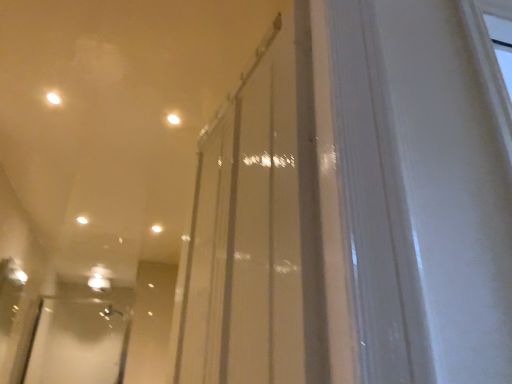
What do you see at coordinates (156, 229) in the screenshot? I see `white glossy light at center, the third light from the front` at bounding box center [156, 229].

What is the approximate width of transparent glass door at center?

transparent glass door at center is 4.95 inches wide.

Image resolution: width=512 pixels, height=384 pixels. I want to click on matte white light at upper center, the 3th light in the back-to-front sequence, so click(173, 119).

How much space does white glossy light at upper center, positioned as the 1th light in left-to-right order, occupy vertically?

The height of white glossy light at upper center, positioned as the 1th light in left-to-right order, is 0.58 inches.

Where is `white glossy light at center, the 1th light in the bottom-to-top sequence`? Image resolution: width=512 pixels, height=384 pixels. white glossy light at center, the 1th light in the bottom-to-top sequence is located at coordinates (156, 229).

Looking at this image, which of these two, matte white light at upper center, which is counted as the 1th light, starting from the right, or transparent glass door at center, stands shorter?

matte white light at upper center, which is counted as the 1th light, starting from the right.

From the picture: Considering the positions of objects matte white light at upper center, the 3th light in the back-to-front sequence, and transparent glass door at center in the image provided, who is more to the right, matte white light at upper center, the 3th light in the back-to-front sequence, or transparent glass door at center?

Positioned to the right is transparent glass door at center.

Is matte white light at upper center, which appears as the third light when viewed from the left, not near transparent glass door at center?

Indeed, matte white light at upper center, which appears as the third light when viewed from the left, is not near transparent glass door at center.

Is point (82, 222) farther from camera compared to point (172, 114)?

Yes, it is.

Between white glossy light at upper center, which is counted as the second light, starting from the back, and matte white light at upper center, positioned as the 1th light in front-to-back order, which one has larger width?

Wider between the two is white glossy light at upper center, which is counted as the second light, starting from the back.

From the image's perspective, between white glossy light at upper center, which is counted as the 2th light, starting from the bottom, and matte white light at upper center, positioned as the 1th light in front-to-back order, who is located below?

From the image's view, white glossy light at upper center, which is counted as the 2th light, starting from the bottom, is below.

From a real-world perspective, is white glossy light at upper center, acting as the 2th light starting from the front, physically above matte white light at upper center, which is the 3th light in bottom-to-top order?

Yes, from a real-world perspective, white glossy light at upper center, acting as the 2th light starting from the front, is above matte white light at upper center, which is the 3th light in bottom-to-top order.

Does white glossy light at center, positioned as the first light in back-to-front order, come behind clear plastic screen door at lower left?

That is False.

Considering the sizes of objects white glossy light at center, which is the third light from top to bottom, and clear plastic screen door at lower left in the image provided, who is thinner, white glossy light at center, which is the third light from top to bottom, or clear plastic screen door at lower left?

Thinner between the two is clear plastic screen door at lower left.

How many degrees apart are the facing directions of white glossy light at center, which is counted as the second light, starting from the right, and clear plastic screen door at lower left?

They differ by 3.03 degrees in their facing directions.

Is white glossy light at center, which is the third light from top to bottom, not inside clear plastic screen door at lower left?

Absolutely, white glossy light at center, which is the third light from top to bottom, is external to clear plastic screen door at lower left.

How distant is matte white light at upper center, which appears as the third light when viewed from the left, from clear plastic screen door at lower left?

matte white light at upper center, which appears as the third light when viewed from the left, and clear plastic screen door at lower left are 10.65 feet apart.

Can you confirm if matte white light at upper center, which ranks as the 1th light in top-to-bottom order, is shorter than clear plastic screen door at lower left?

Yes.

In the image, is matte white light at upper center, which is the 3th light in bottom-to-top order, on the left side or the right side of clear plastic screen door at lower left?

matte white light at upper center, which is the 3th light in bottom-to-top order, is to the right of clear plastic screen door at lower left.

Considering the positions of objects matte white light at upper center, which ranks as the 1th light in top-to-bottom order, and clear plastic screen door at lower left in the image provided, who is in front, matte white light at upper center, which ranks as the 1th light in top-to-bottom order, or clear plastic screen door at lower left?

matte white light at upper center, which ranks as the 1th light in top-to-bottom order, is in front.

Does white glossy light at center, which is the third light from top to bottom, appear on the left side of transparent glass door at center?

Indeed, white glossy light at center, which is the third light from top to bottom, is positioned on the left side of transparent glass door at center.

Image resolution: width=512 pixels, height=384 pixels. Identify the location of light that is the 2nd object above the transparent glass door at center (from a real-world perspective). (156, 229).

From a real-world perspective, is white glossy light at center, the third light from the front, under transparent glass door at center?

No, from a real-world perspective, white glossy light at center, the third light from the front, is not below transparent glass door at center.

How distant is white glossy light at center, positioned as the first light in back-to-front order, from transparent glass door at center?

They are 2.47 meters apart.

Can you confirm if white glossy light at center, which is the third light from top to bottom, is positioned to the right of white glossy light at upper center, positioned as the 1th light in left-to-right order?

Yes, white glossy light at center, which is the third light from top to bottom, is to the right of white glossy light at upper center, positioned as the 1th light in left-to-right order.

From the image's perspective, which one is positioned higher, white glossy light at center, which is the third light from top to bottom, or white glossy light at upper center, marked as the third light in a right-to-left arrangement?

white glossy light at upper center, marked as the third light in a right-to-left arrangement, appears higher in the image.

Identify the location of light below the white glossy light at upper center, which is counted as the second light, starting from the back (from the image's perspective). Image resolution: width=512 pixels, height=384 pixels. (156, 229).

Can you confirm if white glossy light at center, arranged as the 2th light when viewed from the left, is taller than white glossy light at upper center, acting as the 2th light starting from the front?

Yes, white glossy light at center, arranged as the 2th light when viewed from the left, is taller than white glossy light at upper center, acting as the 2th light starting from the front.

Where is `light that is on the right side of white glossy light at center, arranged as the 2th light when viewed from the left`? light that is on the right side of white glossy light at center, arranged as the 2th light when viewed from the left is located at coordinates (173, 119).

Would you say white glossy light at center, the third light from the front, is inside or outside matte white light at upper center, which is the 3th light in bottom-to-top order?

white glossy light at center, the third light from the front, lies outside matte white light at upper center, which is the 3th light in bottom-to-top order.

Does white glossy light at center, positioned as the first light in back-to-front order, touch matte white light at upper center, which is counted as the 1th light, starting from the right?

white glossy light at center, positioned as the first light in back-to-front order, and matte white light at upper center, which is counted as the 1th light, starting from the right, are not in contact.

Looking at this image, is the depth of white glossy light at center, the 1th light in the bottom-to-top sequence, less than that of matte white light at upper center, which appears as the third light when viewed from the left?

No.

At what (x,y) coordinates should I click in order to perform the action: click on the 1st light above the transparent glass door at center (from a real-world perspective). Please return your answer as a coordinate pair (x, y). The width and height of the screenshot is (512, 384). Looking at the image, I should click on (173, 119).

At what (x,y) coordinates should I click in order to perform the action: click on light above the white glossy light at upper center, which is counted as the second light, starting from the back (from the image's perspective). Please return your answer as a coordinate pair (x, y). The height and width of the screenshot is (384, 512). Looking at the image, I should click on point(173,119).

Looking at the image, which one is located closer to transparent glass door at center, matte white light at upper center, positioned as the 1th light in front-to-back order, or clear plastic screen door at lower left?

matte white light at upper center, positioned as the 1th light in front-to-back order, is positioned closer to the anchor transparent glass door at center.

Based on their spatial positions, is white glossy light at center, which is the third light from top to bottom, or clear plastic screen door at lower left closer to white glossy light at upper center, positioned as the 1th light in left-to-right order?

white glossy light at center, which is the third light from top to bottom.

Looking at the image, which one is located further to transparent glass door at center, white glossy light at upper center, which is counted as the second light, starting from the back, or matte white light at upper center, which ranks as the 1th light in top-to-bottom order?

white glossy light at upper center, which is counted as the second light, starting from the back.

When comparing their distances from white glossy light at upper center, the second light in the top-to-bottom sequence, does transparent glass door at center or white glossy light at center, which is the third light from top to bottom, seem further?

Among the two, transparent glass door at center is located further to white glossy light at upper center, the second light in the top-to-bottom sequence.

From the image, which object appears to be nearer to transparent glass door at center, matte white light at upper center, positioned as the 1th light in front-to-back order, or white glossy light at upper center, marked as the third light in a right-to-left arrangement?

matte white light at upper center, positioned as the 1th light in front-to-back order, is positioned closer to the anchor transparent glass door at center.

From the image, which object appears to be nearer to white glossy light at center, arranged as the 2th light when viewed from the left, matte white light at upper center, which ranks as the 1th light in top-to-bottom order, or clear plastic screen door at lower left?

Among the two, matte white light at upper center, which ranks as the 1th light in top-to-bottom order, is located nearer to white glossy light at center, arranged as the 2th light when viewed from the left.

Which object lies further to the anchor point white glossy light at center, positioned as the first light in back-to-front order, transparent glass door at center or matte white light at upper center, which appears as the third light when viewed from the left?

transparent glass door at center is positioned further to the anchor white glossy light at center, positioned as the first light in back-to-front order.

From the image, which object appears to be farther from white glossy light at center, arranged as the 2th light when viewed from the left, white glossy light at upper center, which is counted as the second light, starting from the back, or matte white light at upper center, the 3th light in the back-to-front sequence?

The object further to white glossy light at center, arranged as the 2th light when viewed from the left, is matte white light at upper center, the 3th light in the back-to-front sequence.

In order to click on light between transparent glass door at center and white glossy light at upper center, the second light in the top-to-bottom sequence, along the z-axis in this screenshot , I will do `click(173, 119)`.

The image size is (512, 384). Find the location of `light between matte white light at upper center, which ranks as the 1th light in top-to-bottom order, and white glossy light at center, the 1th light in the bottom-to-top sequence, from front to back`. light between matte white light at upper center, which ranks as the 1th light in top-to-bottom order, and white glossy light at center, the 1th light in the bottom-to-top sequence, from front to back is located at coordinates (82, 220).

Where is `light between white glossy light at upper center, positioned as the 1th light in left-to-right order, and clear plastic screen door at lower left vertically`? The width and height of the screenshot is (512, 384). light between white glossy light at upper center, positioned as the 1th light in left-to-right order, and clear plastic screen door at lower left vertically is located at coordinates (156, 229).